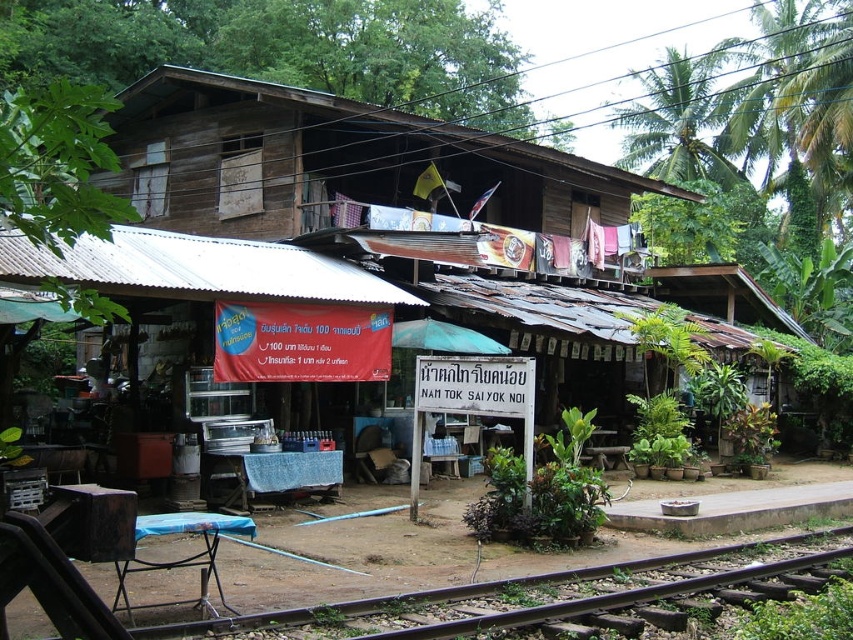
Based on the photo, you are standing in front of the rustic wooden building along the railway track. There is a point marked at coordinates (347, 173). What does this point indicate?

The point marked at coordinates (347, 173) indicates the wooden hut at center.

You are a traveler standing near the wooden hut at center and the brown wooden train track at lower center. Which object is closer to your left side?

The wooden hut at center is positioned on the left side of brown wooden train track at lower center, so it is closer to your left side.